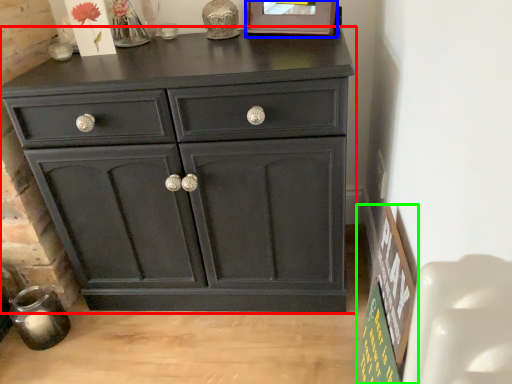
Question: Estimate the real-world distances between objects in this image. Which object is farther from chest of drawers (highlighted by a red box), picture frame (highlighted by a blue box) or bulletin board (highlighted by a green box)?

Choices:
 (A) picture frame
 (B) bulletin board

Answer: (A)